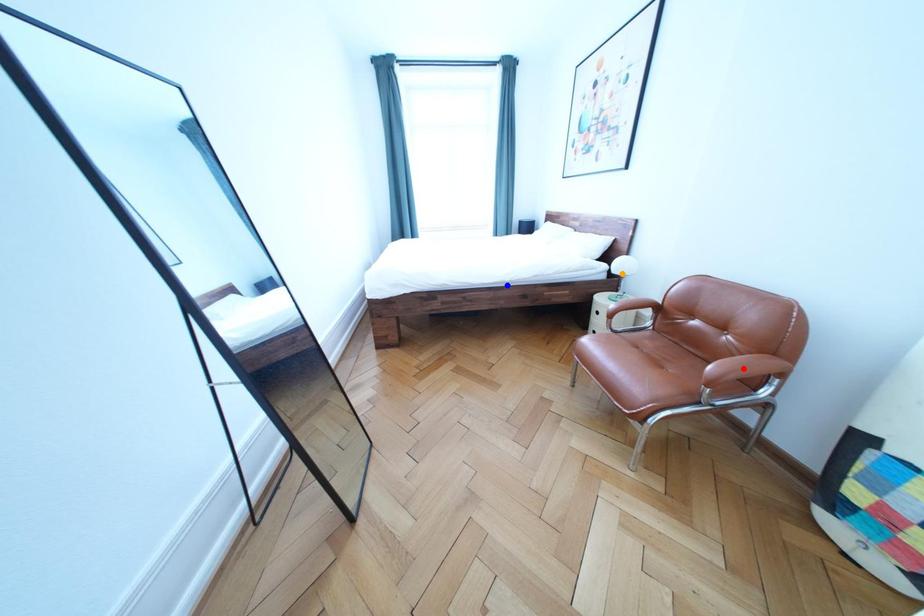
Order these from farthest to nearest:
1. orange point
2. blue point
3. red point

orange point, blue point, red point